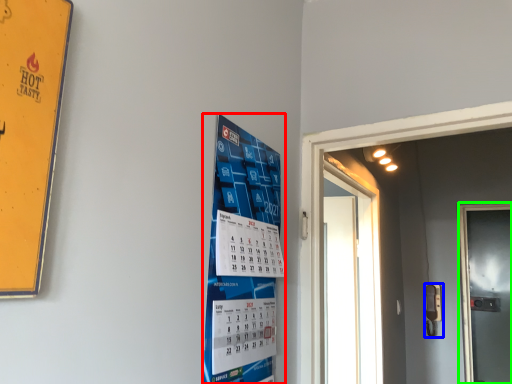
Question: Which is nearer to the poster (highlighted by a red box)? door handle (highlighted by a blue box) or door (highlighted by a green box).

Choices:
 (A) door handle
 (B) door

Answer: (A)